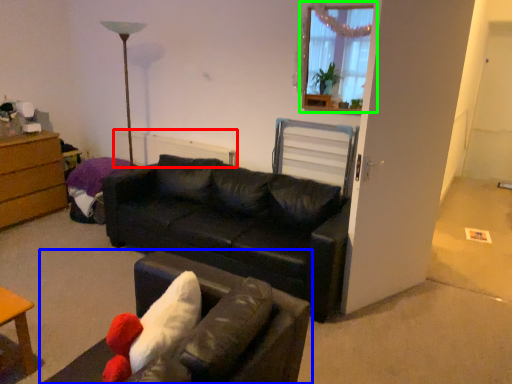
Question: Estimate the real-world distances between objects in this image. Which object is closer to radiator (highlighted by a red box), studio couch (highlighted by a blue box) or window (highlighted by a green box)?

Choices:
 (A) studio couch
 (B) window

Answer: (B)